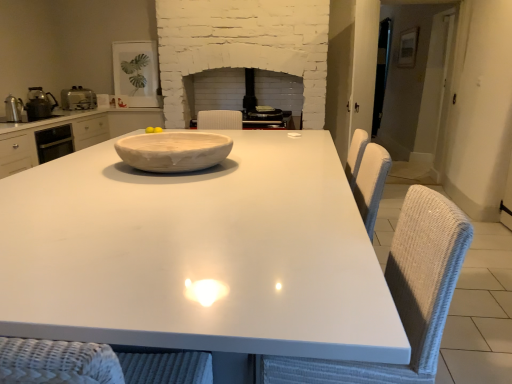
Question: Is satin silver toaster at left, which is counted as the 2th appliance, starting from the back, a part of yellow matte/yellowish smooth lemon at center?

Choices:
 (A) yes
 (B) no

Answer: (B)

Question: Is yellow matte/yellowish smooth lemon at center at the right side of satin silver toaster at left, placed as the third appliance when sorted from front to back?

Choices:
 (A) yes
 (B) no

Answer: (A)

Question: Is yellow matte/yellowish smooth lemon at center facing towards satin silver toaster at left, placed as the third appliance when sorted from front to back?

Choices:
 (A) yes
 (B) no

Answer: (B)

Question: Is yellow matte/yellowish smooth lemon at center positioned with its back to satin silver toaster at left, placed as the third appliance when sorted from front to back?

Choices:
 (A) no
 (B) yes

Answer: (A)

Question: Can you confirm if yellow matte/yellowish smooth lemon at center is wider than satin silver toaster at left, which is counted as the 2th appliance, starting from the back?

Choices:
 (A) no
 (B) yes

Answer: (A)

Question: Considering the relative sizes of yellow matte/yellowish smooth lemon at center and satin silver toaster at left, placed as the third appliance when sorted from front to back, in the image provided, is yellow matte/yellowish smooth lemon at center taller than satin silver toaster at left, placed as the third appliance when sorted from front to back,?

Choices:
 (A) no
 (B) yes

Answer: (A)

Question: From a real-world perspective, does metallic silver kettle at left, the second appliance positioned from the front, stand above metallic silver kettle at left, which is counted as the fourth appliance, starting from the back?

Choices:
 (A) no
 (B) yes

Answer: (B)

Question: Can you confirm if metallic silver kettle at left, the 3th appliance when ordered from back to front, is smaller than metallic silver kettle at left, which is counted as the fourth appliance, starting from the back?

Choices:
 (A) no
 (B) yes

Answer: (A)

Question: From the image's perspective, is metallic silver kettle at left, the 3th appliance when ordered from back to front, below metallic silver kettle at left, the first appliance from the front?

Choices:
 (A) yes
 (B) no

Answer: (B)

Question: Is metallic silver kettle at left, the second appliance positioned from the front, surrounding metallic silver kettle at left, which is counted as the fourth appliance, starting from the back?

Choices:
 (A) yes
 (B) no

Answer: (B)

Question: Can you confirm if metallic silver kettle at left, the 3th appliance when ordered from back to front, is thinner than metallic silver kettle at left, the first appliance from the front?

Choices:
 (A) no
 (B) yes

Answer: (A)

Question: Is metallic silver kettle at left, the second appliance positioned from the front, facing away from metallic silver kettle at left, the first appliance from the front?

Choices:
 (A) yes
 (B) no

Answer: (B)

Question: Is white wicker swivel chair at right outside matte white picture frame at upper left, acting as the fourth appliance starting from the front?

Choices:
 (A) yes
 (B) no

Answer: (A)